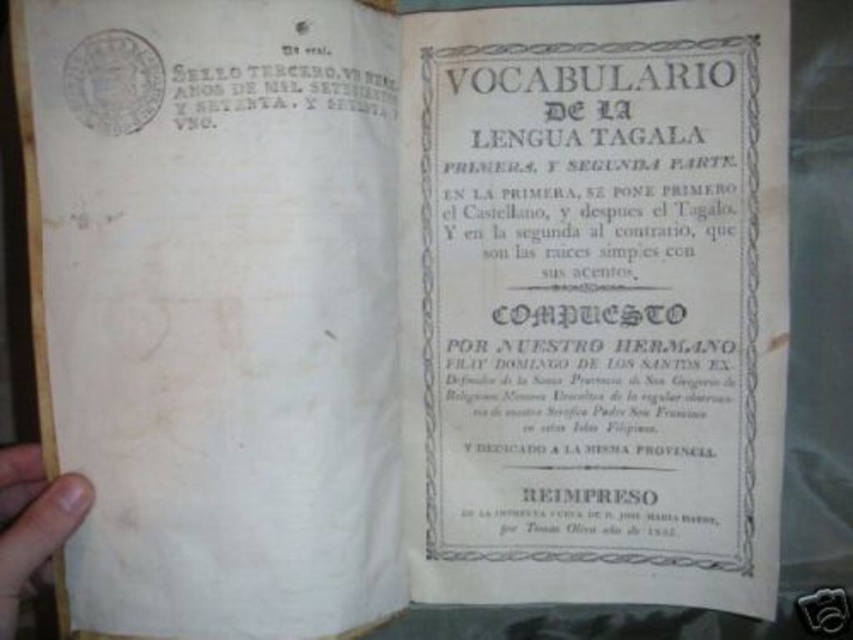
Does white paper title page at center have a larger size compared to brown wood at lower left?

Indeed, white paper title page at center has a larger size compared to brown wood at lower left.

How much distance is there between white paper title page at center and brown wood at lower left?

The distance of white paper title page at center from brown wood at lower left is 12.13 inches.

Where is `white paper title page at center`? This screenshot has width=853, height=640. white paper title page at center is located at coordinates (589, 301).